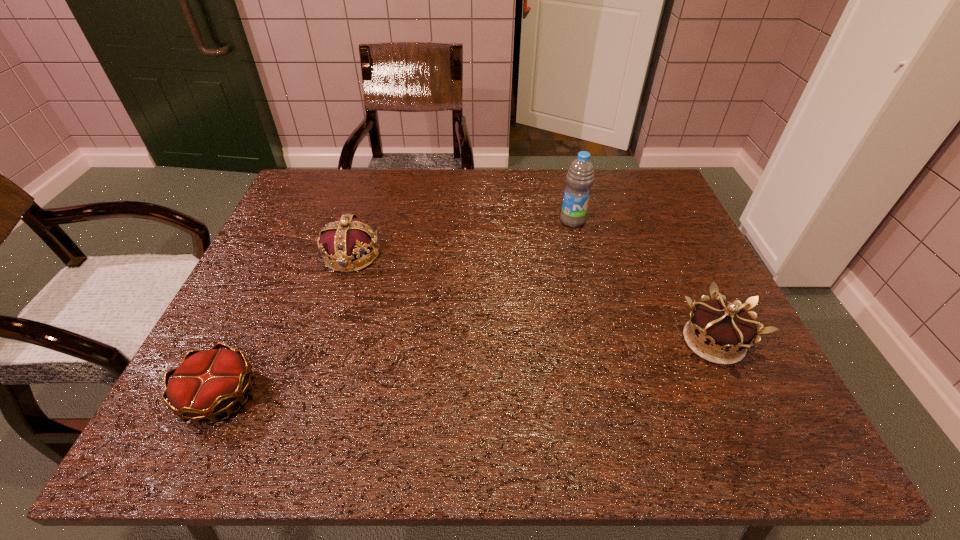
What are the coordinates of `free space located on the right of the leftmost object` in the screenshot? It's located at (327, 396).

Identify the location of object at the far edge. (580, 177).

Identify the location of object located at the near edge. (207, 383).

Where is `object that is at the right edge`? object that is at the right edge is located at coordinates (727, 330).

Where is `object present at the near left corner`? object present at the near left corner is located at coordinates (207, 383).

Locate an element on the screen. free region at the far edge of the desktop is located at coordinates (485, 181).

Image resolution: width=960 pixels, height=540 pixels. In order to click on free space at the near edge of the desktop in this screenshot , I will do `click(522, 420)`.

You are a GUI agent. You are given a task and a screenshot of the screen. Output one action in this format:
    pyautogui.click(x=<x>, y=<y>)
    Task: Click on the free space at the left edge of the desktop
    
    Given the screenshot: What is the action you would take?
    pyautogui.click(x=290, y=259)

Find the location of `vacant area at the right edge of the desktop`. vacant area at the right edge of the desktop is located at coordinates (653, 241).

You are a GUI agent. You are given a task and a screenshot of the screen. Output one action in this format:
    pyautogui.click(x=<x>, y=<y>)
    Task: Click on the free space at the far left corner of the desktop
    
    Given the screenshot: What is the action you would take?
    pyautogui.click(x=332, y=200)